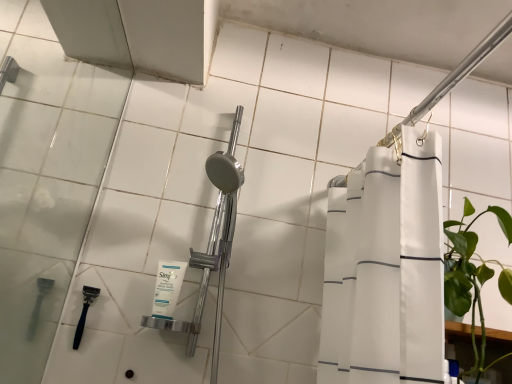
At what (x,y) coordinates should I click in order to perform the action: click on white matte facial cleanser at center. Please return your answer as a coordinate pair (x, y). Looking at the image, I should click on (167, 288).

Identify the location of white matte facial cleanser at center. Image resolution: width=512 pixels, height=384 pixels. point(167,288).

Is white fabric shower curtain at upper right, placed as the 1th shower when sorted from front to back, directly adjacent to white matte facial cleanser at center?

No, white fabric shower curtain at upper right, placed as the 1th shower when sorted from front to back, is not beside white matte facial cleanser at center.

From the image's perspective, between white fabric shower curtain at upper right, placed as the 1th shower when sorted from front to back, and white matte facial cleanser at center, who is located below?

From the image's view, white matte facial cleanser at center is below.

At what (x,y) coordinates should I click in order to perform the action: click on shower in front of the white matte facial cleanser at center. Please return your answer as a coordinate pair (x, y). This screenshot has height=384, width=512. Looking at the image, I should click on click(461, 70).

Does white fabric shower curtain at upper right, placed as the second shower when sorted from bottom to top, turn towards white matte facial cleanser at center?

No, white fabric shower curtain at upper right, placed as the second shower when sorted from bottom to top, does not turn towards white matte facial cleanser at center.

Which is behind, point (94, 291) or point (165, 297)?

Positioned behind is point (94, 291).

From a real-world perspective, is black plastic razor at lower left, positioned as the first shower in left-to-right order, physically below white matte facial cleanser at center?

Indeed, from a real-world perspective, black plastic razor at lower left, positioned as the first shower in left-to-right order, is positioned beneath white matte facial cleanser at center.

Is black plastic razor at lower left, positioned as the second shower in front-to-back order, looking in the opposite direction of white matte facial cleanser at center?

No, black plastic razor at lower left, positioned as the second shower in front-to-back order,'s orientation is not away from white matte facial cleanser at center.

From a real-world perspective, is white fabric shower curtain at upper right, placed as the second shower when sorted from bottom to top, physically located above or below black plastic razor at lower left, positioned as the second shower in front-to-back order?

white fabric shower curtain at upper right, placed as the second shower when sorted from bottom to top, is situated higher than black plastic razor at lower left, positioned as the second shower in front-to-back order, in the real world.

In order to click on shower on the right of the black plastic razor at lower left, which ranks as the 2th shower in top-to-bottom order in this screenshot , I will do `click(461, 70)`.

Who is bigger, white fabric shower curtain at upper right, the first shower in the top-to-bottom sequence, or black plastic razor at lower left, positioned as the first shower in left-to-right order?

white fabric shower curtain at upper right, the first shower in the top-to-bottom sequence.

From the image's perspective, who appears lower, white fabric shower curtain at upper right, placed as the second shower when sorted from bottom to top, or black plastic razor at lower left, the 2th shower in the right-to-left sequence?

black plastic razor at lower left, the 2th shower in the right-to-left sequence, appears lower in the image.

Is black plastic razor at lower left, the 1th shower from the back, not within white fabric shower curtain at upper right, the first shower in the top-to-bottom sequence?

Yes, black plastic razor at lower left, the 1th shower from the back, is outside of white fabric shower curtain at upper right, the first shower in the top-to-bottom sequence.

Considering the relative sizes of black plastic razor at lower left, the 2th shower in the right-to-left sequence, and white fabric shower curtain at upper right, which ranks as the first shower in right-to-left order, in the image provided, is black plastic razor at lower left, the 2th shower in the right-to-left sequence, bigger than white fabric shower curtain at upper right, which ranks as the first shower in right-to-left order,?

No, black plastic razor at lower left, the 2th shower in the right-to-left sequence, is not bigger than white fabric shower curtain at upper right, which ranks as the first shower in right-to-left order.

Considering their positions, is black plastic razor at lower left, positioned as the second shower in front-to-back order, located in front of or behind white fabric shower curtain at upper right, arranged as the second shower when viewed from the left?

Clearly, black plastic razor at lower left, positioned as the second shower in front-to-back order, is behind white fabric shower curtain at upper right, arranged as the second shower when viewed from the left.

Does point (82, 323) appear closer or farther from the camera than point (332, 183)?

Clearly, point (82, 323) is closer to the camera than point (332, 183).

From a real-world perspective, is white matte facial cleanser at center located beneath white fabric shower curtain at upper right, which ranks as the first shower in right-to-left order?

Yes, from a real-world perspective, white matte facial cleanser at center is beneath white fabric shower curtain at upper right, which ranks as the first shower in right-to-left order.

From the image's perspective, is white matte facial cleanser at center positioned above or below white fabric shower curtain at upper right, the first shower in the top-to-bottom sequence?

white matte facial cleanser at center is situated lower than white fabric shower curtain at upper right, the first shower in the top-to-bottom sequence, in the image.

How different are the orientations of white matte facial cleanser at center and white fabric shower curtain at upper right, which ranks as the first shower in right-to-left order, in degrees?

109 degrees.

In terms of width, does white matte facial cleanser at center look wider or thinner when compared to white fabric shower curtain at upper right, which ranks as the first shower in right-to-left order?

Considering their sizes, white matte facial cleanser at center looks slimmer than white fabric shower curtain at upper right, which ranks as the first shower in right-to-left order.

Measure the distance between white matte facial cleanser at center and black plastic razor at lower left, which ranks as the 2th shower in top-to-bottom order.

white matte facial cleanser at center is 7.46 inches away from black plastic razor at lower left, which ranks as the 2th shower in top-to-bottom order.

From the picture: Between white matte facial cleanser at center and black plastic razor at lower left, the 2th shower in the right-to-left sequence, which one has larger size?

white matte facial cleanser at center is bigger.

From a real-world perspective, is white matte facial cleanser at center over black plastic razor at lower left, the 2th shower in the right-to-left sequence?

Yes.

Locate an element on the screen. The height and width of the screenshot is (384, 512). shower above the white matte facial cleanser at center (from the image's perspective) is located at coordinates (461, 70).

Where is `shower below the white matte facial cleanser at center (from the image's perspective)`? Image resolution: width=512 pixels, height=384 pixels. shower below the white matte facial cleanser at center (from the image's perspective) is located at coordinates (84, 312).

Based on their spatial positions, is black plastic razor at lower left, positioned as the second shower in front-to-back order, or white fabric shower curtain at upper right, arranged as the second shower when viewed from the left, closer to white matte facial cleanser at center?

black plastic razor at lower left, positioned as the second shower in front-to-back order.

Which object lies nearer to the anchor point black plastic razor at lower left, which ranks as the 2th shower in top-to-bottom order, white fabric shower curtain at upper right, arranged as the second shower when viewed from the left, or white matte facial cleanser at center?

Based on the image, white matte facial cleanser at center appears to be nearer to black plastic razor at lower left, which ranks as the 2th shower in top-to-bottom order.

Based on their spatial positions, is white fabric shower curtain at upper right, the first shower in the top-to-bottom sequence, or black plastic razor at lower left, positioned as the first shower in left-to-right order, closer to white matte facial cleanser at center?

Among the two, black plastic razor at lower left, positioned as the first shower in left-to-right order, is located nearer to white matte facial cleanser at center.

Based on the photo, when comparing their distances from white fabric shower curtain at upper right, placed as the second shower when sorted from bottom to top, does white matte facial cleanser at center or black plastic razor at lower left, positioned as the second shower in front-to-back order, seem closer?

white matte facial cleanser at center is closer to white fabric shower curtain at upper right, placed as the second shower when sorted from bottom to top.

When comparing their distances from black plastic razor at lower left, which ranks as the 2th shower in top-to-bottom order, does white matte facial cleanser at center or white fabric shower curtain at upper right, placed as the 1th shower when sorted from front to back, seem closer?

white matte facial cleanser at center.

Considering their positions, is black plastic razor at lower left, the 1th shower from the back, positioned further to white fabric shower curtain at upper right, the first shower in the top-to-bottom sequence, than white matte facial cleanser at center?

Among the two, black plastic razor at lower left, the 1th shower from the back, is located further to white fabric shower curtain at upper right, the first shower in the top-to-bottom sequence.

Where is `toiletry between black plastic razor at lower left, positioned as the first shower in left-to-right order, and white fabric shower curtain at upper right, arranged as the second shower when viewed from the back, in the horizontal direction`? Image resolution: width=512 pixels, height=384 pixels. toiletry between black plastic razor at lower left, positioned as the first shower in left-to-right order, and white fabric shower curtain at upper right, arranged as the second shower when viewed from the back, in the horizontal direction is located at coordinates (167, 288).